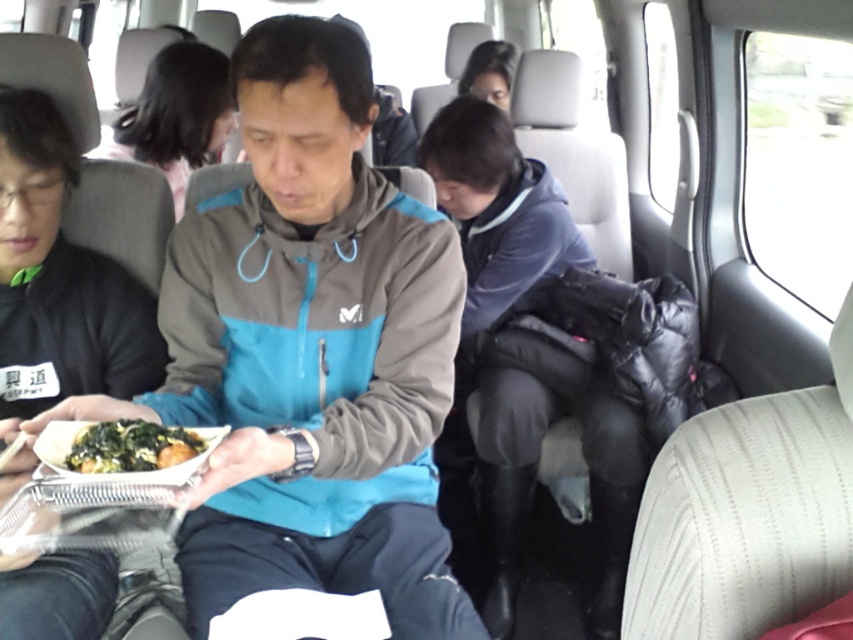
Describe the element at coordinates (177, 115) in the screenshot. The width and height of the screenshot is (853, 640). I see `black matte hair at upper center` at that location.

Is point (189, 128) farther from viewer compared to point (146, 442)?

Yes, it is behind point (146, 442).

I want to click on black matte hair at upper center, so click(177, 115).

Can you confirm if black matte hair at upper center is bigger than smooth black hair at upper center?

Yes, black matte hair at upper center is bigger than smooth black hair at upper center.

Which of these two, black matte hair at upper center or smooth black hair at upper center, stands shorter?

smooth black hair at upper center

This screenshot has width=853, height=640. Identify the location of black matte hair at upper center. (177, 115).

Between black matte jacket at left and green leafy vegetables at center, which one appears on the right side from the viewer's perspective?

From the viewer's perspective, green leafy vegetables at center appears more on the right side.

Who is taller, black matte jacket at left or green leafy vegetables at center?

black matte jacket at left is taller.

Identify the location of black matte jacket at left. (59, 280).

I want to click on black matte jacket at left, so click(59, 280).